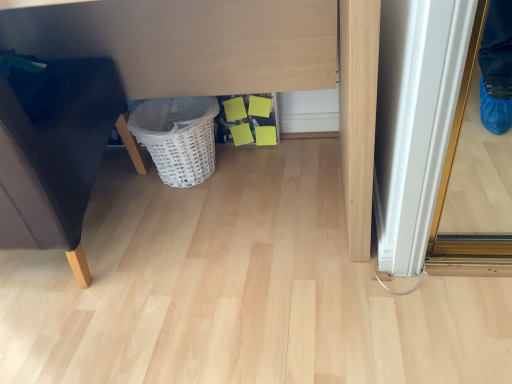
Question: Is white wicker basket at lower center bigger than matte white vanity at center?

Choices:
 (A) no
 (B) yes

Answer: (A)

Question: Is the depth of white wicker basket at lower center greater than that of matte white vanity at center?

Choices:
 (A) no
 (B) yes

Answer: (B)

Question: Can you confirm if white wicker basket at lower center is positioned to the right of matte white vanity at center?

Choices:
 (A) yes
 (B) no

Answer: (A)

Question: Would you say matte white vanity at center is part of white wicker basket at lower center's contents?

Choices:
 (A) no
 (B) yes

Answer: (A)

Question: Considering the relative positions of white wicker basket at lower center and matte white vanity at center in the image provided, is white wicker basket at lower center to the left of matte white vanity at center from the viewer's perspective?

Choices:
 (A) yes
 (B) no

Answer: (B)

Question: In terms of width, does matte white vanity at center look wider or thinner when compared to matte black sofa at left?

Choices:
 (A) thin
 (B) wide

Answer: (B)

Question: From a real-world perspective, is matte white vanity at center positioned above or below matte black sofa at left?

Choices:
 (A) below
 (B) above

Answer: (B)

Question: Considering their positions, is matte white vanity at center located in front of or behind matte black sofa at left?

Choices:
 (A) front
 (B) behind

Answer: (B)

Question: From the image's perspective, is matte white vanity at center above or below matte black sofa at left?

Choices:
 (A) above
 (B) below

Answer: (A)

Question: From the image's perspective, is white wicker basket at lower center located above or below matte white vanity at center?

Choices:
 (A) below
 (B) above

Answer: (A)

Question: Considering the positions of point 201,117 and point 117,6, is point 201,117 closer or farther from the camera than point 117,6?

Choices:
 (A) closer
 (B) farther

Answer: (B)

Question: Based on their sizes in the image, would you say white wicker basket at lower center is bigger or smaller than matte white vanity at center?

Choices:
 (A) small
 (B) big

Answer: (A)

Question: Is white wicker basket at lower center inside the boundaries of matte white vanity at center, or outside?

Choices:
 (A) outside
 (B) inside

Answer: (B)

Question: In terms of size, does matte white vanity at center appear bigger or smaller than white wicker basket at lower center?

Choices:
 (A) small
 (B) big

Answer: (B)

Question: From a real-world perspective, is matte white vanity at center physically located above or below white wicker basket at lower center?

Choices:
 (A) above
 (B) below

Answer: (A)